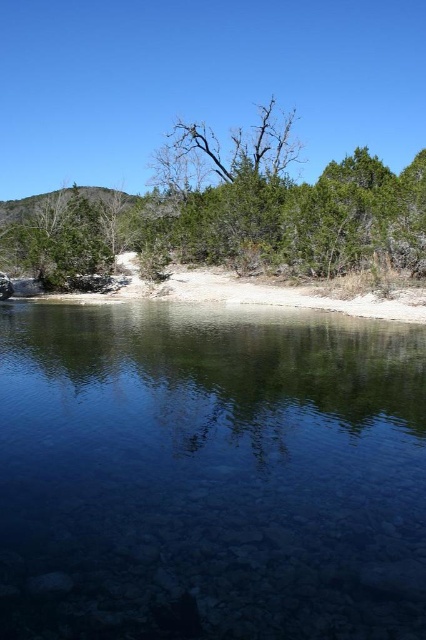
Is brown/dry wood tree at upper center shorter than bare branches at center?

No, brown/dry wood tree at upper center is not shorter than bare branches at center.

Is brown/dry wood tree at upper center further to camera compared to bare branches at center?

No.

At what (x,y) coordinates should I click in order to perform the action: click on brown/dry wood tree at upper center. Please return your answer as a coordinate pair (x, y). Looking at the image, I should click on (227, 212).

Which is above, clear glassy water at center or brown/dry wood tree at upper center?

brown/dry wood tree at upper center is above.

The height and width of the screenshot is (640, 426). I want to click on clear glassy water at center, so [x=210, y=474].

Is clear glassy water at center above bare branches at center?

No.

Is clear glassy water at center in front of bare branches at center?

Yes, it is.

Image resolution: width=426 pixels, height=640 pixels. What are the coordinates of `clear glassy water at center` in the screenshot? It's located at (210, 474).

The height and width of the screenshot is (640, 426). What are the coordinates of `clear glassy water at center` in the screenshot? It's located at [x=210, y=474].